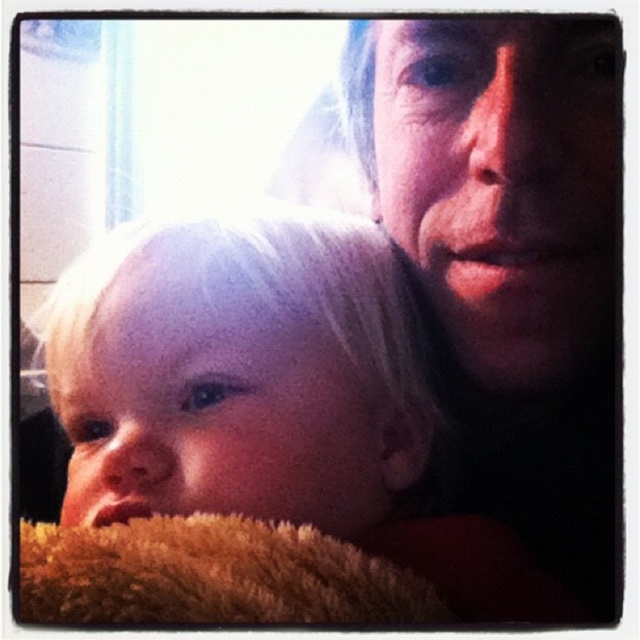
Which is behind, point (316, 404) or point (502, 74)?

Positioned behind is point (316, 404).

The height and width of the screenshot is (640, 640). What are the coordinates of `blonde hair at center` in the screenshot? It's located at (237, 371).